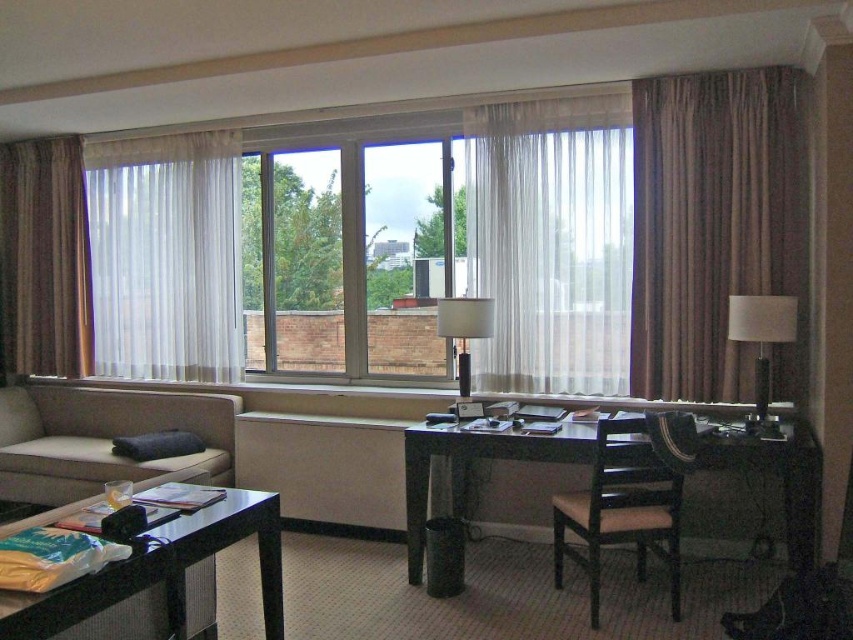
Question: Does clear glass window at center have a smaller size compared to black glass table at lower left?

Choices:
 (A) yes
 (B) no

Answer: (B)

Question: Based on their relative distances, which object is farther from the matte black lamp at center?

Choices:
 (A) clear glass window at center
 (B) brown leather chair at center
 (C) white sheer curtain at center
 (D) white glossy table lamp at right

Answer: (D)

Question: From the image, what is the correct spatial relationship of clear glass window at center in relation to black glass table at lower left?

Choices:
 (A) right
 (B) left

Answer: (A)

Question: Is dark wood desk at center below brown leather chair at center?

Choices:
 (A) no
 (B) yes

Answer: (A)

Question: Which of the following is the closest to the observer?

Choices:
 (A) (741, 301)
 (B) (157, 328)

Answer: (A)

Question: Which of the following is the farthest from the observer?

Choices:
 (A) clear glass window at center
 (B) brown textured curtain at right
 (C) white sheer curtain at center

Answer: (A)